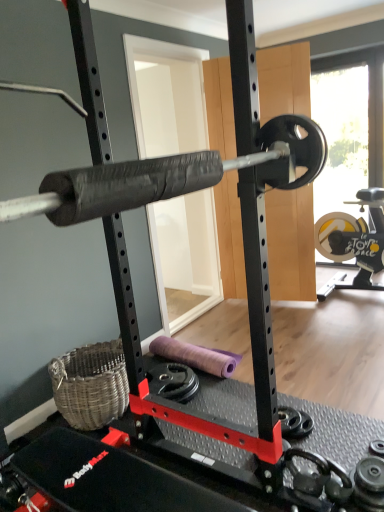
Image resolution: width=384 pixels, height=512 pixels. Describe the element at coordinates (294, 422) in the screenshot. I see `black rubber dumbbell at lower right` at that location.

Image resolution: width=384 pixels, height=512 pixels. Identify the location of black rubber dumbbell at lower right. (294, 422).

Find the location of a particular element. This screenshot has width=384, height=512. transparent glass window at upper right is located at coordinates (360, 193).

The image size is (384, 512). What do you see at coordinates (360, 193) in the screenshot? I see `transparent glass window at upper right` at bounding box center [360, 193].

Locate an element on the screen. The width and height of the screenshot is (384, 512). black rubber dumbbell at lower right is located at coordinates (294, 422).

In the image, is transparent glass window at upper right on the left side or the right side of black rubber dumbbell at lower right?

In the image, transparent glass window at upper right appears on the right side of black rubber dumbbell at lower right.

Which object is closer to the camera taking this photo, transparent glass window at upper right or black rubber dumbbell at lower right?

black rubber dumbbell at lower right is in front.

Is point (345, 77) closer to camera compared to point (293, 433)?

No, it is not.

From the image's perspective, which object appears higher, transparent glass window at upper right or black rubber dumbbell at lower right?

transparent glass window at upper right.

From a real-world perspective, is transparent glass window at upper right over black rubber dumbbell at lower right?

Yes, from a real-world perspective, transparent glass window at upper right is on top of black rubber dumbbell at lower right.

Considering the sizes of objects transparent glass window at upper right and black rubber dumbbell at lower right in the image provided, who is wider, transparent glass window at upper right or black rubber dumbbell at lower right?

black rubber dumbbell at lower right.

Considering the sizes of objects transparent glass window at upper right and black rubber dumbbell at lower right in the image provided, who is taller, transparent glass window at upper right or black rubber dumbbell at lower right?

With more height is transparent glass window at upper right.

Based on their sizes in the image, would you say transparent glass window at upper right is bigger or smaller than black rubber dumbbell at lower right?

In the image, transparent glass window at upper right appears to be larger than black rubber dumbbell at lower right.

Can black rubber dumbbell at lower right be found inside transparent glass window at upper right?

No, black rubber dumbbell at lower right is not surrounded by transparent glass window at upper right.

Is transparent glass window at upper right positioned far away from black rubber dumbbell at lower right?

Absolutely, transparent glass window at upper right is distant from black rubber dumbbell at lower right.

Is transparent glass window at upper right turned away from black rubber dumbbell at lower right?

No, black rubber dumbbell at lower right is not at the back of transparent glass window at upper right.

What's the angular difference between transparent glass window at upper right and black rubber dumbbell at lower right's facing directions?

The angle between the facing direction of transparent glass window at upper right and the facing direction of black rubber dumbbell at lower right is 87.2 degrees.

How distant is transparent glass window at upper right from black rubber dumbbell at lower right?

They are 2.44 meters apart.

At what (x,y) coordinates should I click in order to perform the action: click on window screen above the black rubber dumbbell at lower right (from a real-world perspective). Please return your answer as a coordinate pair (x, y). Looking at the image, I should click on (360, 193).

From the picture: Visually, is black rubber dumbbell at lower right positioned to the left or to the right of transparent glass window at upper right?

From the image, it's evident that black rubber dumbbell at lower right is to the left of transparent glass window at upper right.

In the scene shown: Is the depth of black rubber dumbbell at lower right greater than that of transparent glass window at upper right?

No, it is not.

Which is closer, (297, 422) or (369, 83)?

Point (297, 422).

From the image's perspective, is black rubber dumbbell at lower right positioned above or below transparent glass window at upper right?

black rubber dumbbell at lower right is situated lower than transparent glass window at upper right in the image.

From a real-world perspective, does black rubber dumbbell at lower right sit lower than transparent glass window at upper right?

Yes, from a real-world perspective, black rubber dumbbell at lower right is beneath transparent glass window at upper right.

Which object is thinner, black rubber dumbbell at lower right or transparent glass window at upper right?

With smaller width is transparent glass window at upper right.

In terms of height, does black rubber dumbbell at lower right look taller or shorter compared to transparent glass window at upper right?

black rubber dumbbell at lower right is shorter than transparent glass window at upper right.

Considering the sizes of black rubber dumbbell at lower right and transparent glass window at upper right in the image, is black rubber dumbbell at lower right bigger or smaller than transparent glass window at upper right?

In the image, black rubber dumbbell at lower right appears to be smaller than transparent glass window at upper right.

Is black rubber dumbbell at lower right inside or outside of transparent glass window at upper right?

The correct answer is: outside.

Consider the image. Is black rubber dumbbell at lower right not near transparent glass window at upper right?

That's right, there is a large distance between black rubber dumbbell at lower right and transparent glass window at upper right.

Based on the photo, is black rubber dumbbell at lower right positioned with its back to transparent glass window at upper right?

No, black rubber dumbbell at lower right is not facing the opposite direction of transparent glass window at upper right.

Locate an element on the screen. This screenshot has height=512, width=384. dumbbell below the transparent glass window at upper right (from a real-world perspective) is located at coordinates (294, 422).

Where is `dumbbell in front of the transparent glass window at upper right`? This screenshot has width=384, height=512. dumbbell in front of the transparent glass window at upper right is located at coordinates (294, 422).

This screenshot has height=512, width=384. What are the coordinates of `dumbbell on the left of transparent glass window at upper right` in the screenshot? It's located at (294, 422).